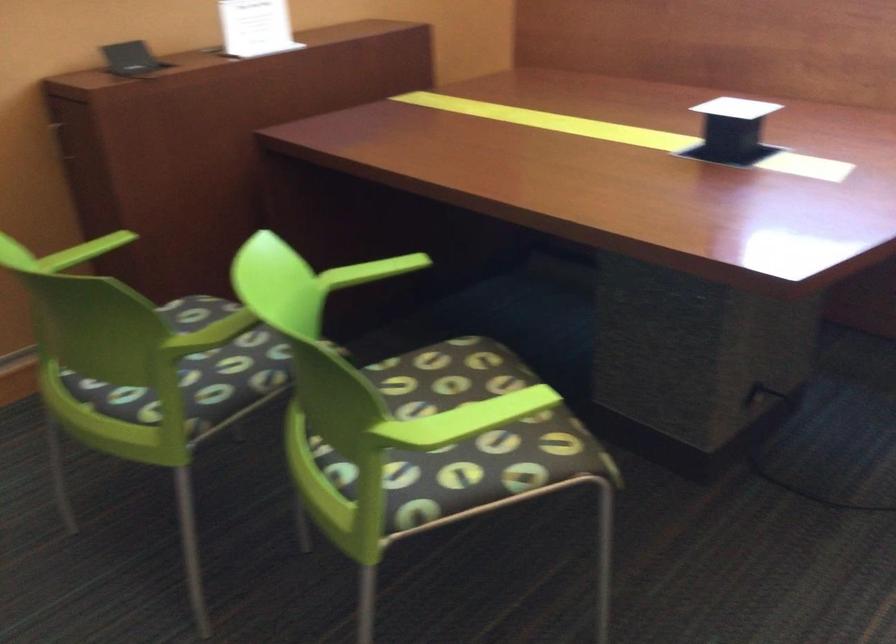
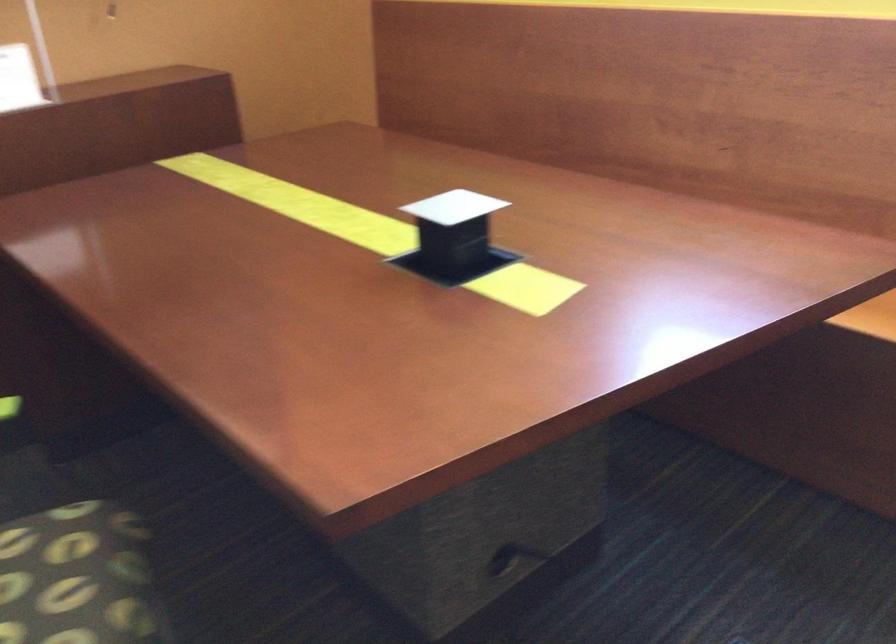
In the scene shown: In a continuous first-person perspective shot, in which direction is the camera moving?

The movement direction of the cameraman is right, forward.